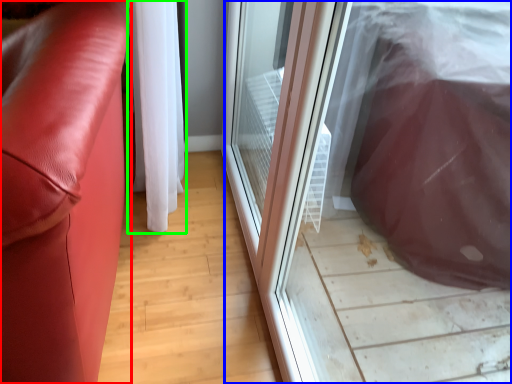
Question: Considering the real-world distances, which object is closest to furniture (highlighted by a red box)? screen door (highlighted by a blue box) or curtain (highlighted by a green box).

Choices:
 (A) screen door
 (B) curtain

Answer: (B)